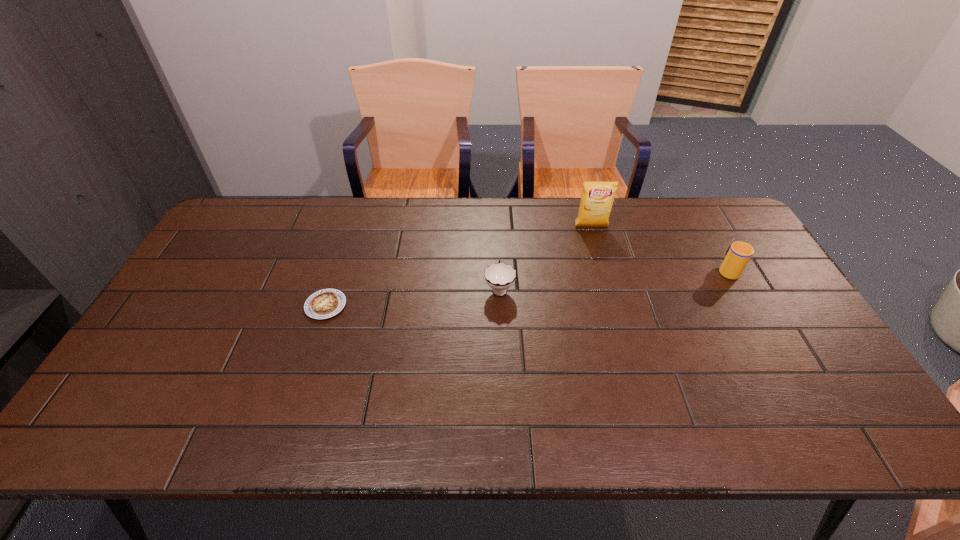
Identify the location of vacant space located 0.170m on the side of the taller cup with the handle. (703, 227).

Image resolution: width=960 pixels, height=540 pixels. What are the coordinates of `blank area located 0.240m on the side of the taller cup with the handle` in the screenshot? It's located at (696, 214).

Where is `vacant space located on the side of the left cup with the handle`? The image size is (960, 540). vacant space located on the side of the left cup with the handle is located at coordinates (497, 246).

You are a GUI agent. You are given a task and a screenshot of the screen. Output one action in this format:
    pyautogui.click(x=<x>, y=<y>)
    Task: Click on the vacant space located on the side of the left cup with the handle
    This screenshot has height=540, width=960.
    Given the screenshot: What is the action you would take?
    pyautogui.click(x=497, y=240)

Find the location of `vacant space located 0.390m on the side of the left cup with the handle`. vacant space located 0.390m on the side of the left cup with the handle is located at coordinates (495, 199).

Image resolution: width=960 pixels, height=540 pixels. I want to click on vacant area situated on the front of the shortest object, so click(281, 442).

In order to click on object located at the far edge in this screenshot , I will do `click(597, 199)`.

What are the coordinates of `object that is at the right edge` in the screenshot? It's located at (738, 254).

Locate an element on the screen. The width and height of the screenshot is (960, 540). free space at the far edge is located at coordinates (408, 209).

Find the location of a particular element. The width and height of the screenshot is (960, 540). free space at the near edge of the desktop is located at coordinates (762, 420).